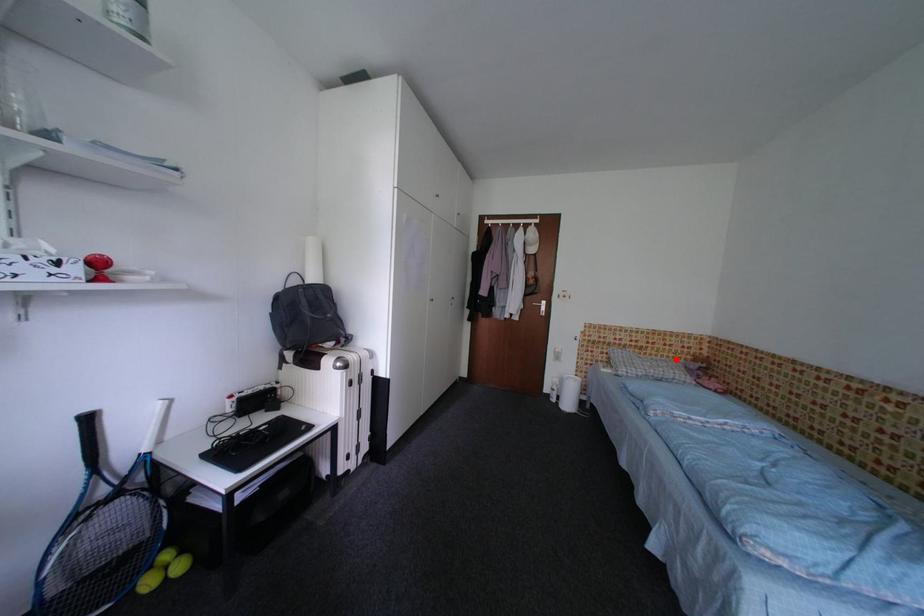
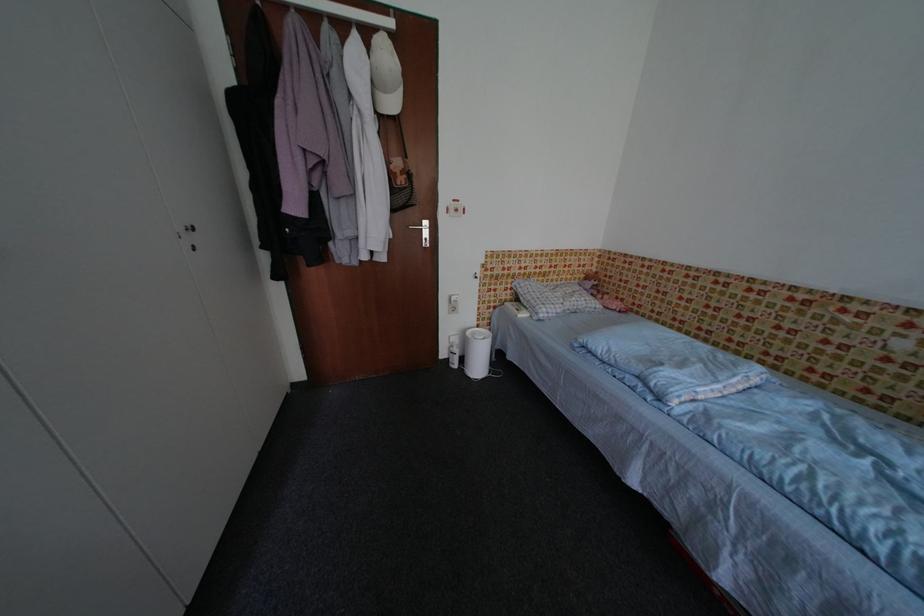
Question: I am providing you with two images of the same scene from different viewpoints. Image1 has a red point marked. In image2, the corresponding 3D location appears at what relative position? Reply with the corresponding letter.

Choices:
 (A) Closer
 (B) Farther

Answer: (A)